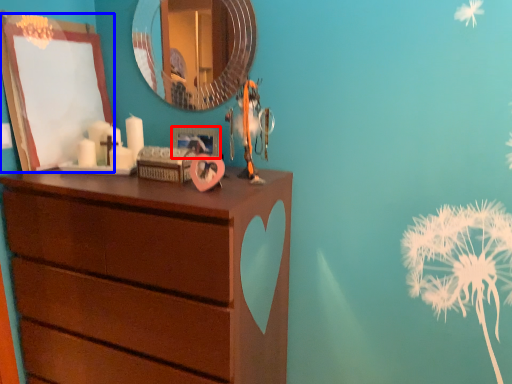
Question: Which object appears farthest to the camera in this image, picture frame (highlighted by a red box) or picture frame (highlighted by a blue box)?

Choices:
 (A) picture frame
 (B) picture frame

Answer: (A)